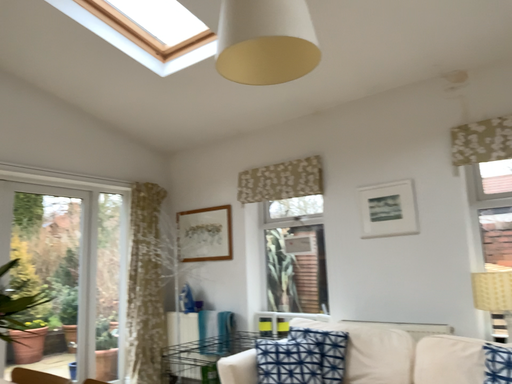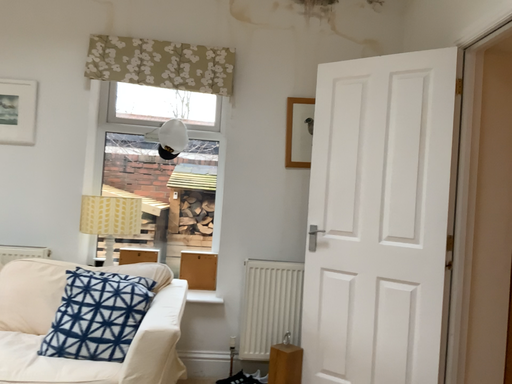
Question: How did the camera likely rotate when shooting the video?

Choices:
 (A) rotated upward
 (B) rotated downward

Answer: (B)